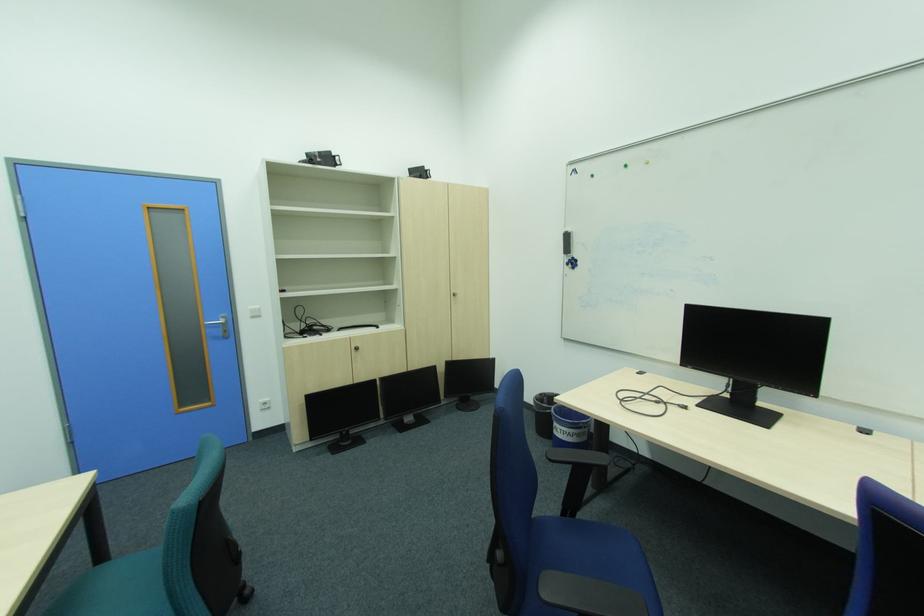
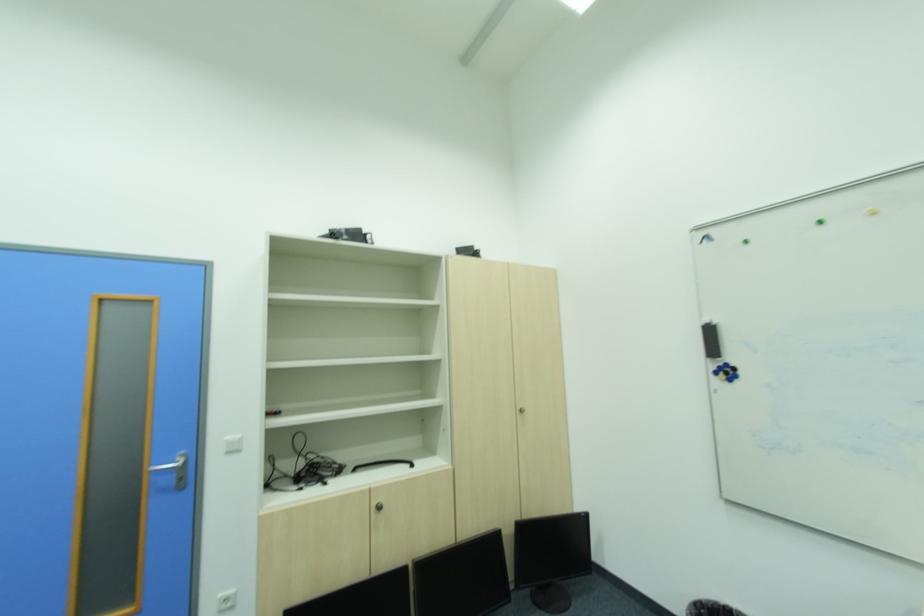
Locate, in the second image, the point that corresponds to point (261, 310) in the first image.

(237, 443)